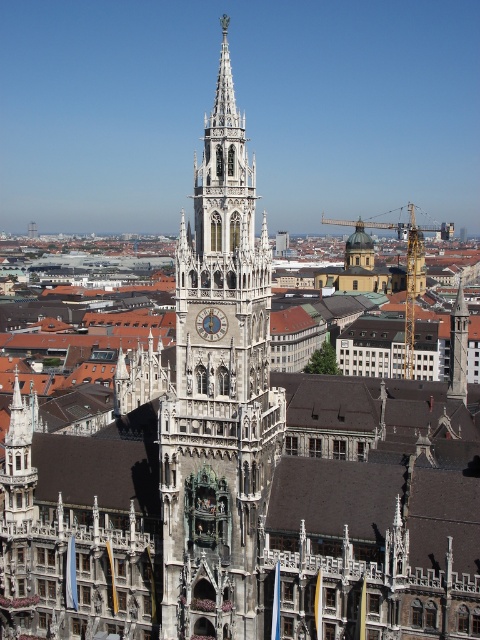
Consider the image. Is white stone clock tower at center closer to camera compared to matte gray clock at center?

Yes, it is.

Who is more forward, (263, 337) or (216, 333)?

Point (216, 333) is in front.

Identify the location of white stone clock tower at center. (218, 394).

The width and height of the screenshot is (480, 640). Identify the location of white stone clock tower at center. (218, 394).